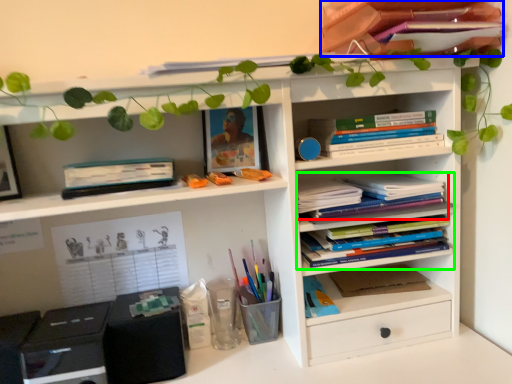
Question: Which object is positioned farthest from book (highlighted by a red box)? Select from book (highlighted by a blue box) and book (highlighted by a green box).

Choices:
 (A) book
 (B) book

Answer: (A)